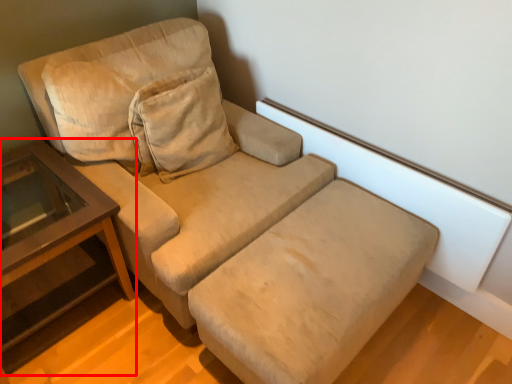
Question: From the image's perspective, where is table (annotated by the red box) located in relation to footrest in the image?

Choices:
 (A) below
 (B) above

Answer: (B)